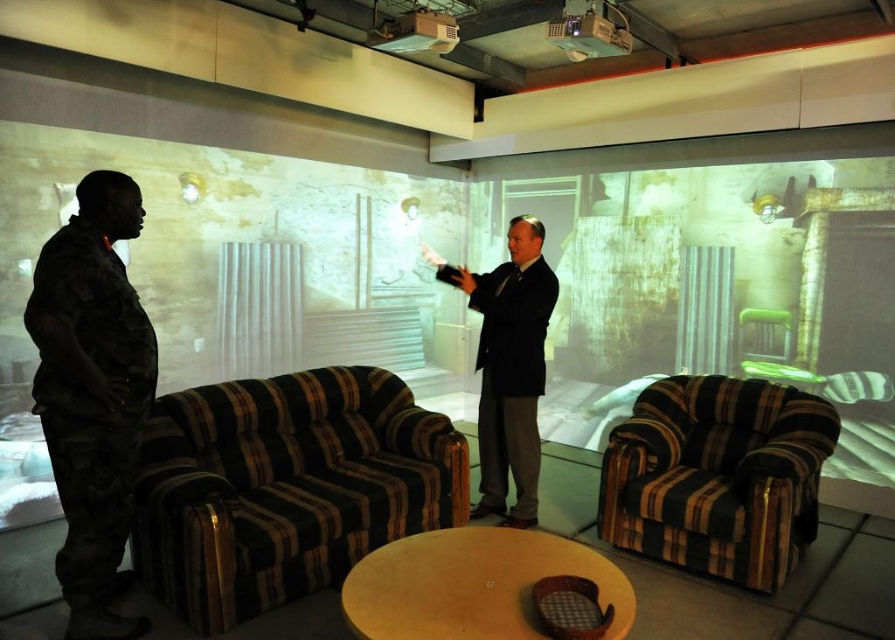
You are a delivery person who needs to place a large package between the striped fabric couch at center and the striped fabric armchair at center. The package is 1.5 meters long. Can you fit it between them without moving either piece of furniture?

The distance between the striped fabric couch at center and the striped fabric armchair at center is 1.42 meters, which is shorter than the 1.5 meters length of the package. Therefore, the package cannot fit between them without moving the furniture.

You are planning to place a 2.5 meters long sofa in a room. The current furniture includes a striped fabric couch at center and a striped fabric armchair at center. Based on the scene description, can the sofa fit between the two existing pieces of furniture?

The striped fabric couch at center is wider than the striped fabric armchair at center. However, without specific measurements of the space between them, it is impossible to determine if the 2.5 meters long sofa will fit.